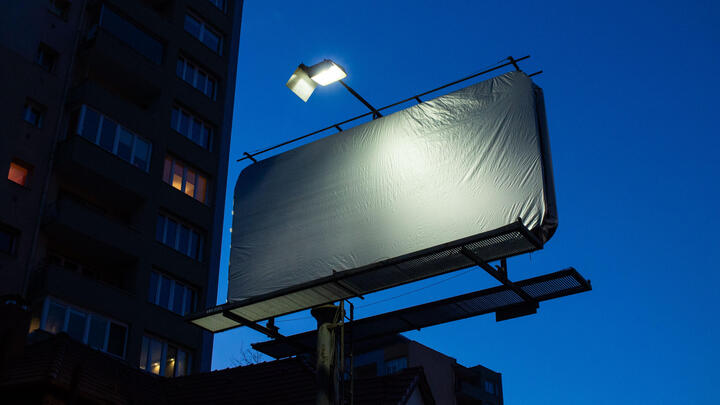
The image size is (720, 405). In order to click on stands in this screenshot , I will do `click(438, 318)`, `click(392, 272)`.